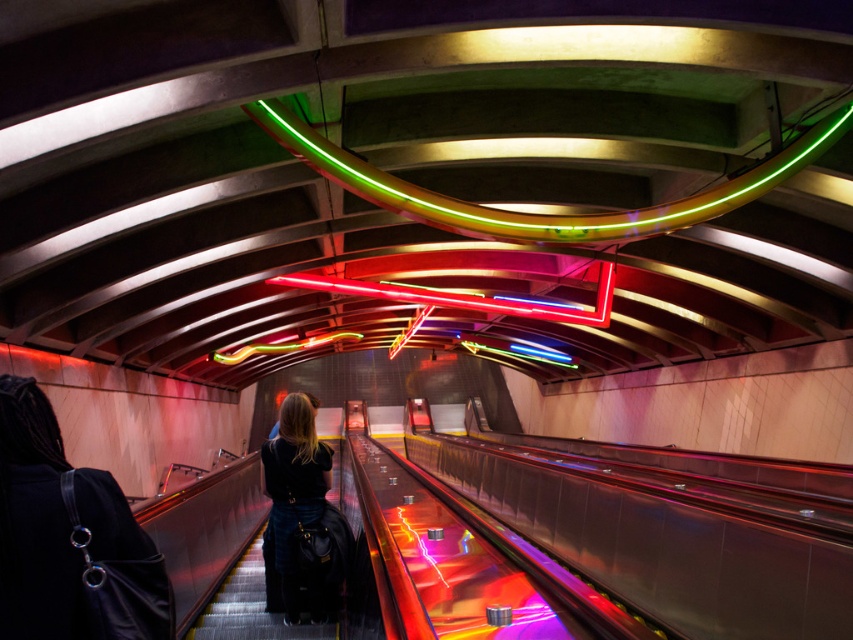
Question: Is black leather jacket at lower left to the right of neon/glass tube at upper center from the viewer's perspective?

Choices:
 (A) no
 (B) yes

Answer: (A)

Question: Which of the following is the closest to the observer?

Choices:
 (A) (293, 547)
 (B) (15, 413)
 (C) (277, 124)

Answer: (B)

Question: Which of the following is the farthest from the observer?

Choices:
 (A) click(320, 618)
 (B) click(24, 624)

Answer: (A)

Question: Is black leather jacket at lower left in front of dark blue denim jeans at center?

Choices:
 (A) yes
 (B) no

Answer: (A)

Question: Which point is farther to the camera?

Choices:
 (A) neon/glass tube at upper center
 (B) black leather jacket at lower left
 (C) dark blue denim jeans at center

Answer: (A)

Question: Observing the image, what is the correct spatial positioning of black leather jacket at lower left in reference to dark blue denim jeans at center?

Choices:
 (A) below
 (B) above

Answer: (B)